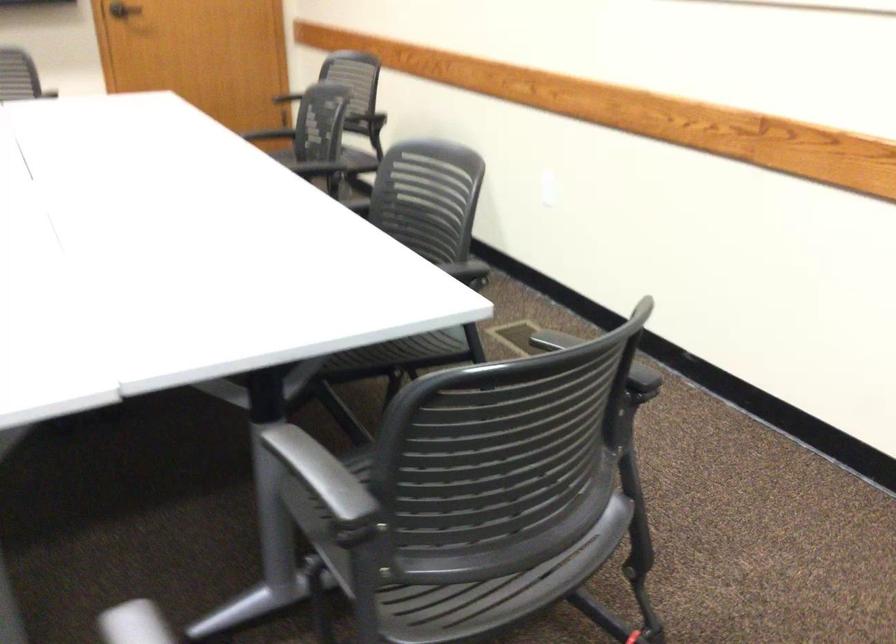
Where is `black chair sitting surface`? This screenshot has height=644, width=896. black chair sitting surface is located at coordinates (496, 590).